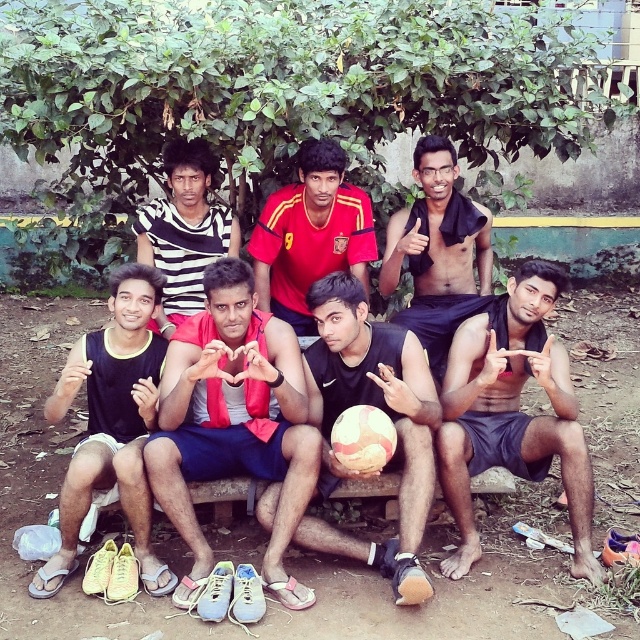
Question: Can you confirm if red fabric vest at center is positioned above shiny black towel at center?

Choices:
 (A) yes
 (B) no

Answer: (B)

Question: Which object is closer to the camera taking this photo?

Choices:
 (A) dark gray shorts at center
 (B) shiny black towel at center

Answer: (A)

Question: Is the position of red fabric vest at center more distant than that of red jersey at center?

Choices:
 (A) yes
 (B) no

Answer: (B)

Question: Considering the real-world distances, which object is farthest from the red fabric vest at center?

Choices:
 (A) matte pink soccer ball at center
 (B) striped fabric shirt at center
 (C) red jersey at center
 (D) dark gray shorts at center

Answer: (D)

Question: Which object is the farthest from the dark gray shorts at center?

Choices:
 (A) striped fabric shirt at center
 (B) matte pink soccer ball at center

Answer: (A)

Question: In this image, where is black matte tank top at center located relative to red jersey at center?

Choices:
 (A) right
 (B) left

Answer: (B)